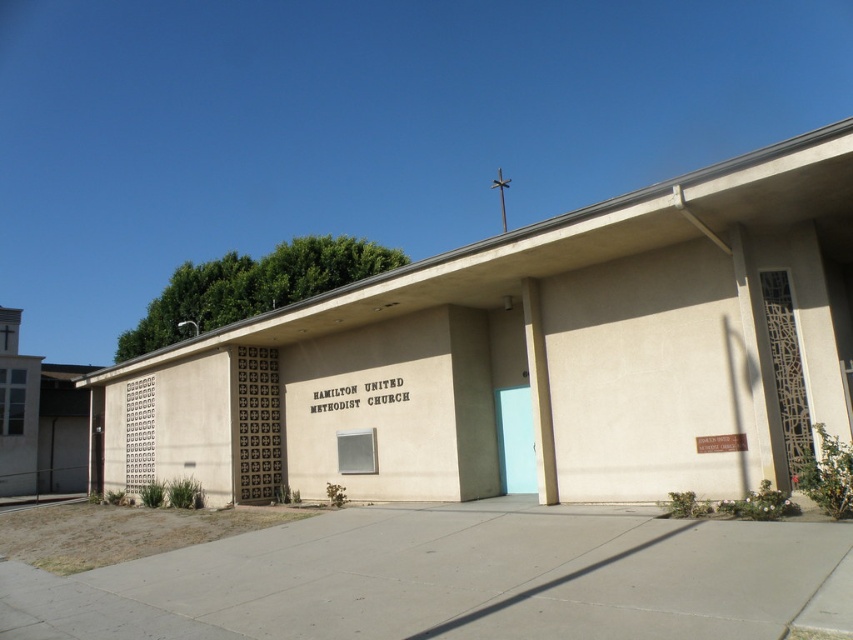
You are a delivery person standing at the entrance of Hamilton United Methodist Church. You need to deliver a package to the office located near the brown textured door at center and then to the chapel near the light blue matte door at center. If you start at the entrance, which door should you approach first to minimize the distance traveled?

You should approach the brown textured door at center first since it is closer to the entrance than the light blue matte door at center, as they are 6.06 meters apart.

You are a visitor arriving at the Hamilton United Methodist Church and want to enter. You see two doors, the brown textured door at center and the light blue matte door at center. Which door is located lower?

The brown textured door at center is positioned under the light blue matte door at center, so the brown textured door at center is the lower one.